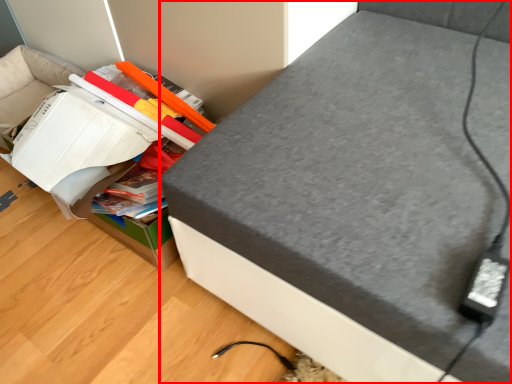
Question: Considering the relative positions of furniture (annotated by the red box) and cardboard box in the image provided, where is furniture (annotated by the red box) located with respect to the staircase?

Choices:
 (A) left
 (B) right

Answer: (B)